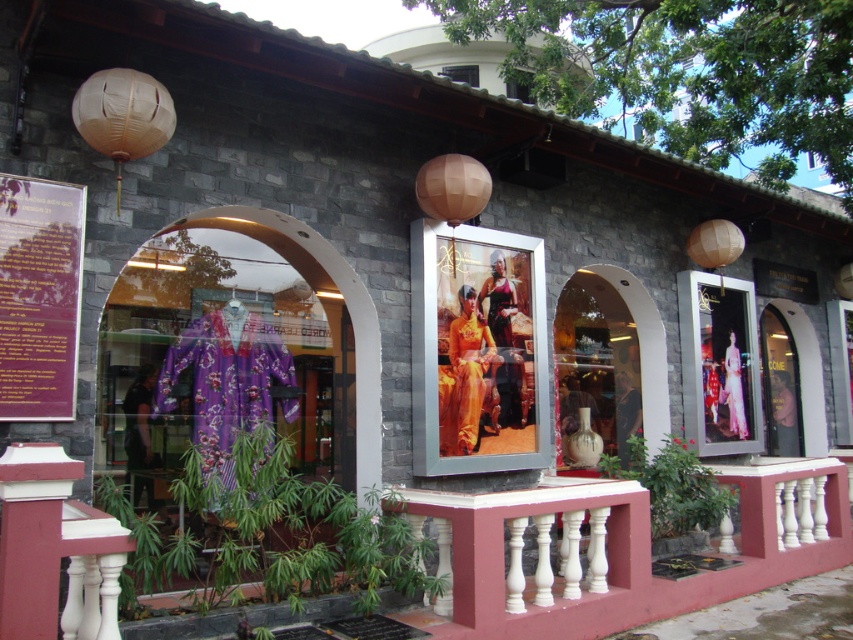
You are standing outside the shop and want to take a photo of the metallic silver frame at center. Where should you position yourself to capture it in the center of your camera viewfinder?

You should position yourself directly in front of the metallic silver frame at center located at point (477, 349) to ensure it appears centered in your camera viewfinder.

You are a customer entering the shop and want to see both the white painted wood balustrade at center and the purple paper at left. Which object will you see first as you walk into the shop?

You will see the white painted wood balustrade at center first because the purple paper at left is behind it, making the balustrade more visible upon entering.